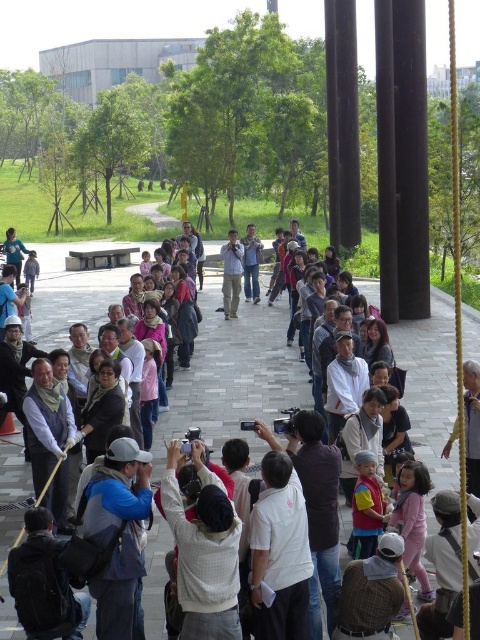
You are standing at the origin point of the coordinate system where the pavement starts. You want to reach the blue fabric backpack at center. What direction should you move in to reach it?

The blue fabric backpack at center is located at coordinate point 0.839 on the x axis and 0.250 on the y axis. Since you are at the origin point, you should move in the positive x and positive y direction to reach it.

You are standing in the park and see the white cotton shirt at center and the blue fabric backpack at center. Which object is taller?

The white cotton shirt at center is taller than the blue fabric backpack at center.